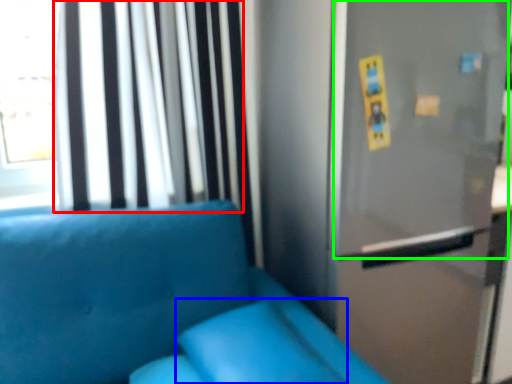
Question: Estimate the real-world distances between objects in this image. Which object is closer to curtain (highlighted by a red box), pillow (highlighted by a blue box) or screen door (highlighted by a green box)?

Choices:
 (A) pillow
 (B) screen door

Answer: (B)